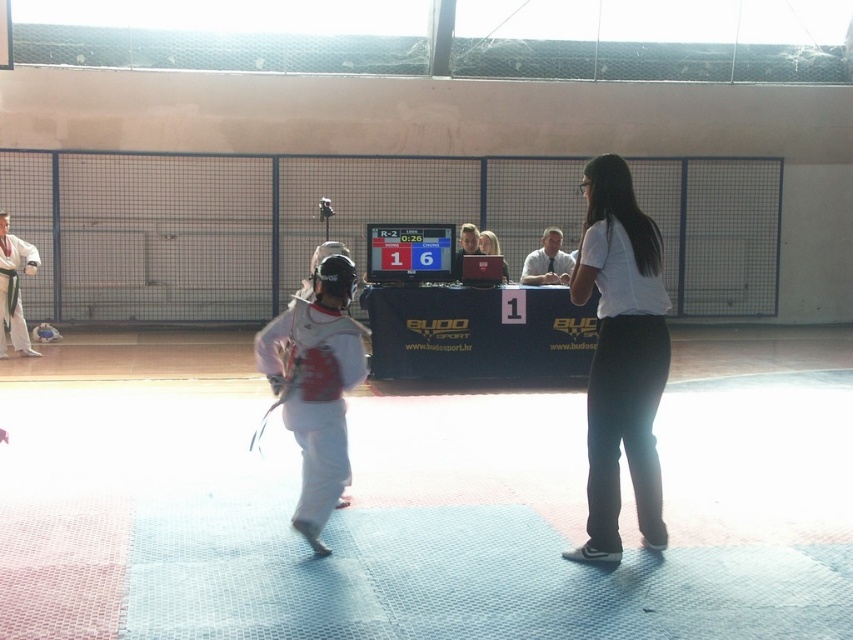
Between white matte shirt at center and white matte karate uniform at left, which one is positioned higher?

white matte karate uniform at left is higher up.

Is white matte shirt at center to the right of white matte karate uniform at left from the viewer's perspective?

Indeed, white matte shirt at center is positioned on the right side of white matte karate uniform at left.

Is point (645, 384) positioned after point (27, 336)?

No, (645, 384) is in front of (27, 336).

You are a GUI agent. You are given a task and a screenshot of the screen. Output one action in this format:
    pyautogui.click(x=<x>, y=<y>)
    Task: Click on the white matte shirt at center
    Image resolution: width=853 pixels, height=640 pixels.
    Given the screenshot: What is the action you would take?
    pyautogui.click(x=621, y=356)

I want to click on white matte shirt at center, so pos(621,356).

Is white matte shirt at center smaller than white matte karate uniform at center?

No, white matte shirt at center is not smaller than white matte karate uniform at center.

The height and width of the screenshot is (640, 853). I want to click on white matte shirt at center, so pyautogui.click(x=621, y=356).

Is white matte shirt at center bigger than matte white shirt at center?

Indeed, white matte shirt at center has a larger size compared to matte white shirt at center.

Between white matte shirt at center and matte white shirt at center, which one appears on the right side from the viewer's perspective?

white matte shirt at center

Identify the location of white matte shirt at center. The height and width of the screenshot is (640, 853). (621, 356).